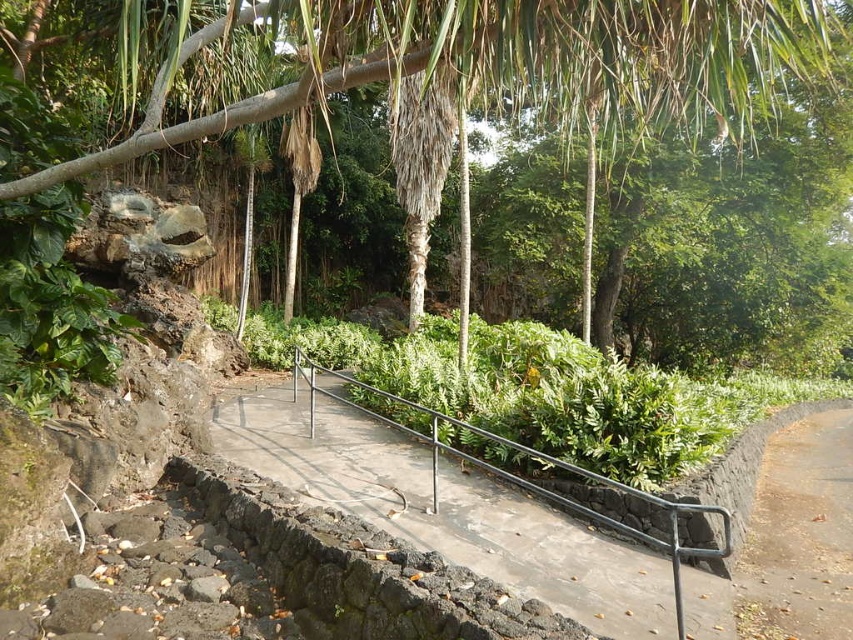
Question: Is concrete at center further to the viewer compared to dirt path at lower right?

Choices:
 (A) yes
 (B) no

Answer: (B)

Question: Which object is closer to the camera taking this photo?

Choices:
 (A) dirt path at lower right
 (B) concrete at center
 (C) green leafy tree at center

Answer: (C)

Question: From the image, what is the correct spatial relationship of green leafy tree at center in relation to dirt path at lower right?

Choices:
 (A) below
 (B) above

Answer: (B)

Question: Which point appears closest to the camera in this image?

Choices:
 (A) (801, 612)
 (B) (709, 612)
 (C) (260, 92)

Answer: (B)

Question: Is green leafy tree at center positioned at the back of concrete at center?

Choices:
 (A) no
 (B) yes

Answer: (A)

Question: Which point is closer to the camera?

Choices:
 (A) dirt path at lower right
 (B) green leafy tree at center
 (C) concrete at center

Answer: (B)